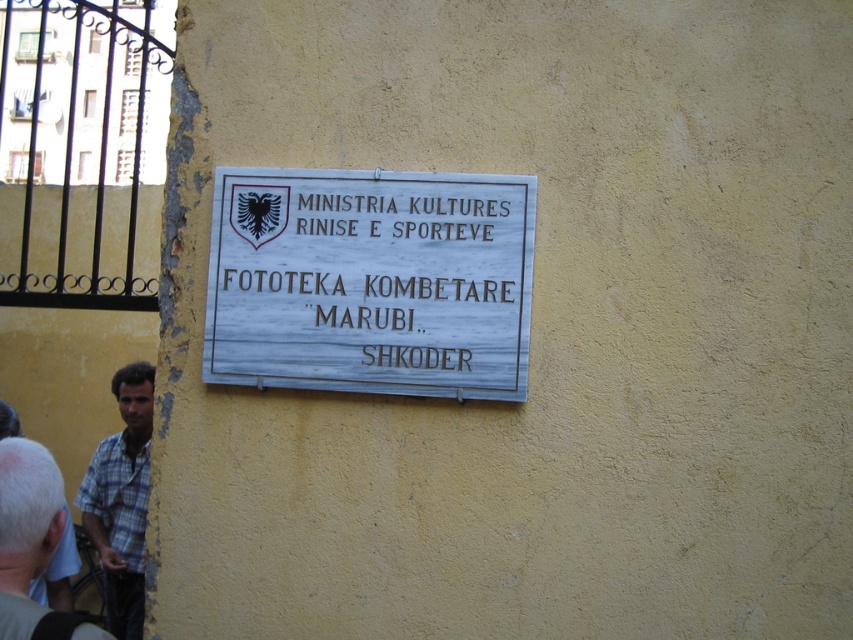
Question: Among these objects, which one is farthest from the camera?

Choices:
 (A) plaid fabric shirt at lower left
 (B) plaid shirt at lower left
 (C) white wooden sign at center

Answer: (B)

Question: Where is plaid shirt at lower left located in relation to plaid fabric shirt at lower left in the image?

Choices:
 (A) above
 (B) below

Answer: (B)

Question: Which point is closer to the camera?

Choices:
 (A) plaid fabric shirt at lower left
 (B) white wooden sign at center

Answer: (A)

Question: Does white wooden sign at center have a lesser width compared to plaid fabric shirt at lower left?

Choices:
 (A) yes
 (B) no

Answer: (B)

Question: Which object appears farthest from the camera in this image?

Choices:
 (A) plaid fabric shirt at lower left
 (B) plaid shirt at lower left
 (C) white wooden sign at center

Answer: (B)

Question: Is white wooden sign at center above plaid shirt at lower left?

Choices:
 (A) yes
 (B) no

Answer: (A)